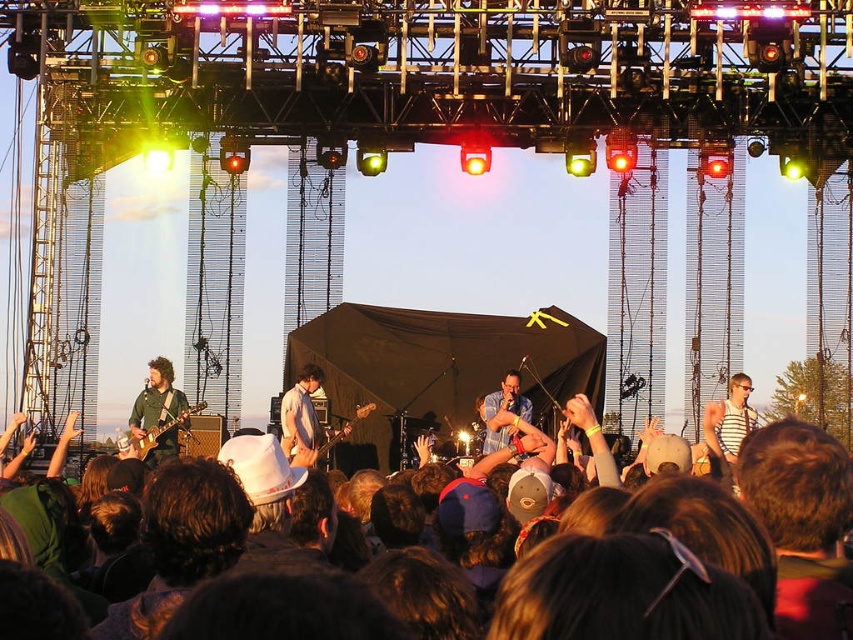
Between shiny green guitar at left and blue denim shirt at center, which one is positioned lower?

shiny green guitar at left is below.

Identify the location of shiny green guitar at left. This screenshot has width=853, height=640. (158, 412).

Does brown hair at center appear on the right side of light blue fabric guitar at center?

Indeed, brown hair at center is positioned on the right side of light blue fabric guitar at center.

Is point (695, 525) less distant than point (308, 390)?

Yes, point (695, 525) is closer to viewer.

Identify the location of brown hair at center. Image resolution: width=853 pixels, height=640 pixels. (798, 476).

Which is above, light blue fabric guitar at center or blue denim shirt at center?

blue denim shirt at center is higher up.

Does light blue fabric guitar at center have a lesser width compared to blue denim shirt at center?

In fact, light blue fabric guitar at center might be wider than blue denim shirt at center.

Does point (306, 368) lie behind point (514, 388)?

That is True.

This screenshot has width=853, height=640. In order to click on light blue fabric guitar at center in this screenshot , I will do 305,419.